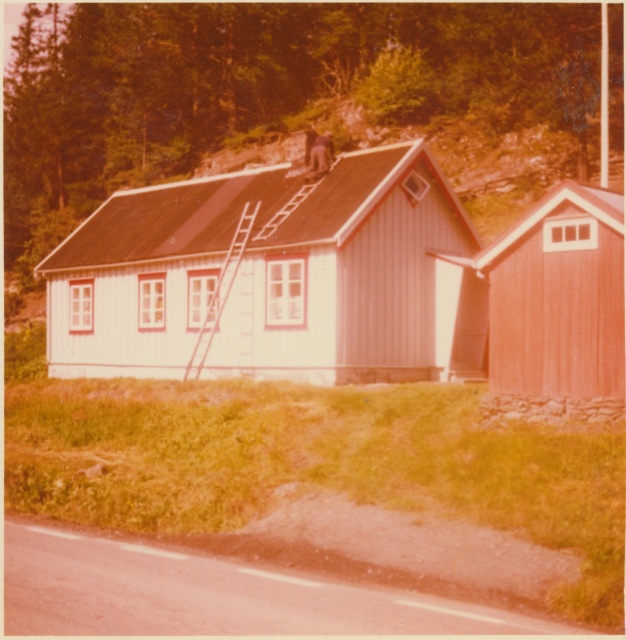
Which of these two, white wooden hut at center or metallic ladder at center, stands taller?

With more height is white wooden hut at center.

Does white wooden hut at center have a greater height compared to metallic ladder at center?

Yes, white wooden hut at center is taller than metallic ladder at center.

Describe the element at coordinates (274, 276) in the screenshot. I see `white wooden hut at center` at that location.

In order to click on white wooden hut at center in this screenshot , I will do `click(274, 276)`.

Is point (618, 400) less distant than point (213, 321)?

That is True.

Between smooth wooden shed at right and metallic ladder at center, which one is positioned higher?

metallic ladder at center is above.

Find the location of a particular element. smooth wooden shed at right is located at coordinates (557, 307).

Does white wooden hut at center appear over smooth wooden shed at right?

Yes.

How far apart are white wooden hut at center and smooth wooden shed at right?

white wooden hut at center is 11.44 meters from smooth wooden shed at right.

Locate an element on the screen. white wooden hut at center is located at coordinates (274, 276).

This screenshot has width=626, height=640. I want to click on white wooden hut at center, so click(x=274, y=276).